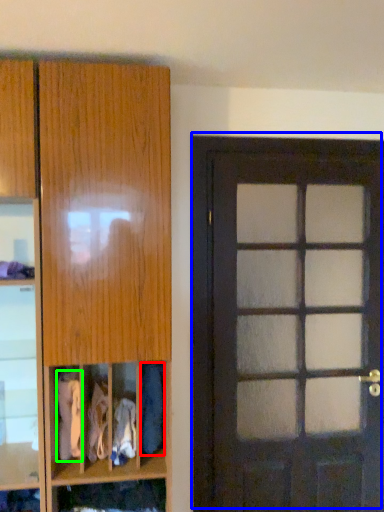
Question: Considering the real-world distances, which object is closest to clothing (highlighted by a red box)? door (highlighted by a blue box) or clothing (highlighted by a green box).

Choices:
 (A) door
 (B) clothing

Answer: (B)